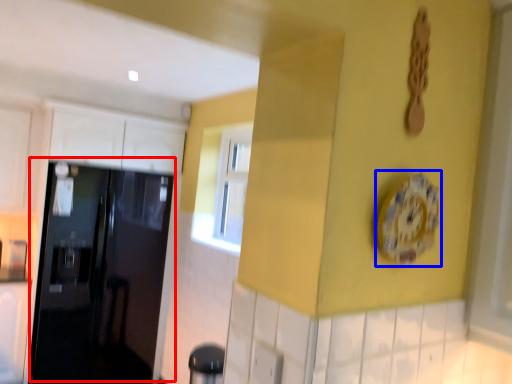
Question: Which object appears farthest to the camera in this image, door (highlighted by a red box) or clock (highlighted by a blue box)?

Choices:
 (A) door
 (B) clock

Answer: (A)